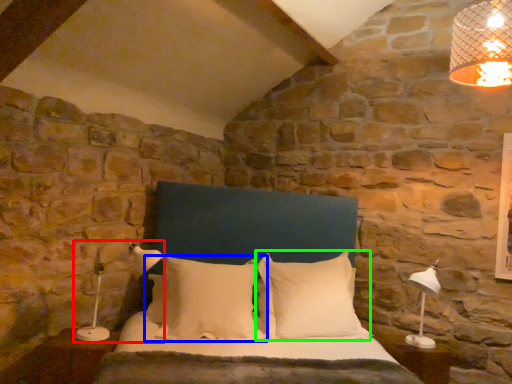
Question: Based on their relative distances, which object is nearer to lamp (highlighted by a red box)? Choose from pillow (highlighted by a blue box) and pillow (highlighted by a green box).

Choices:
 (A) pillow
 (B) pillow

Answer: (A)